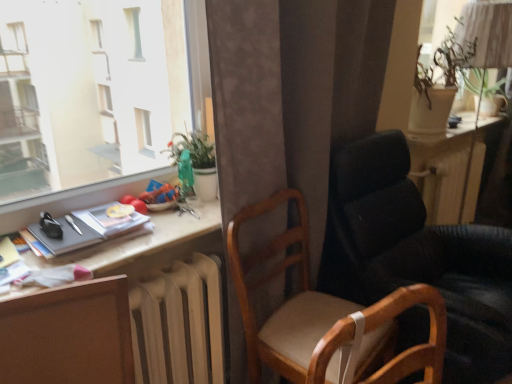
Where is `free spot above matte black book at left (from a real-world perspective)`? free spot above matte black book at left (from a real-world perspective) is located at coordinates (82, 220).